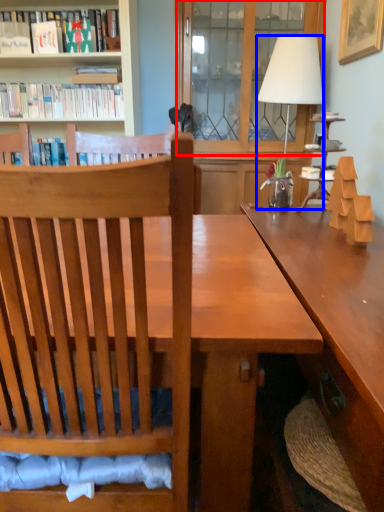
Question: Which of the following is the closest to the observer, glass door (highlighted by a red box) or lamp (highlighted by a blue box)?

Choices:
 (A) glass door
 (B) lamp

Answer: (B)